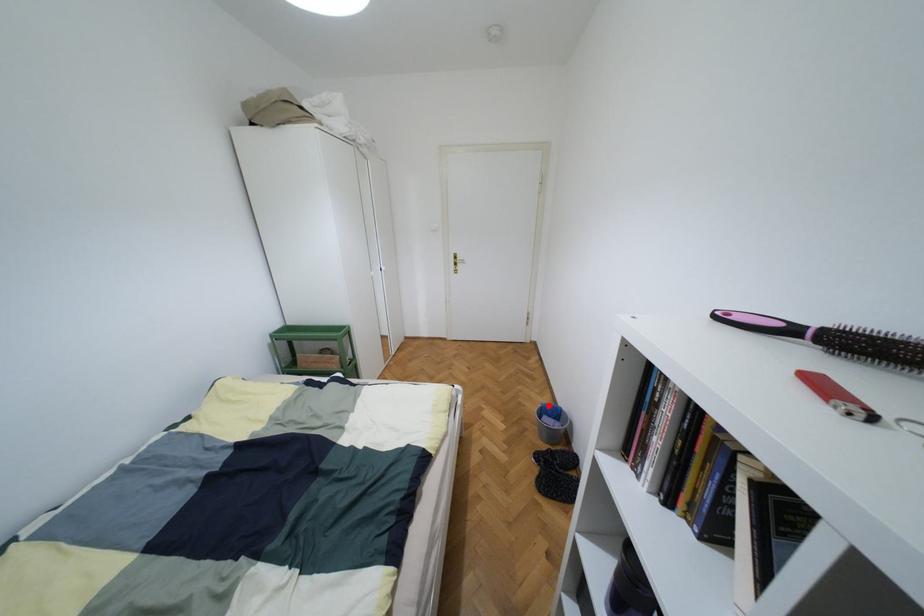
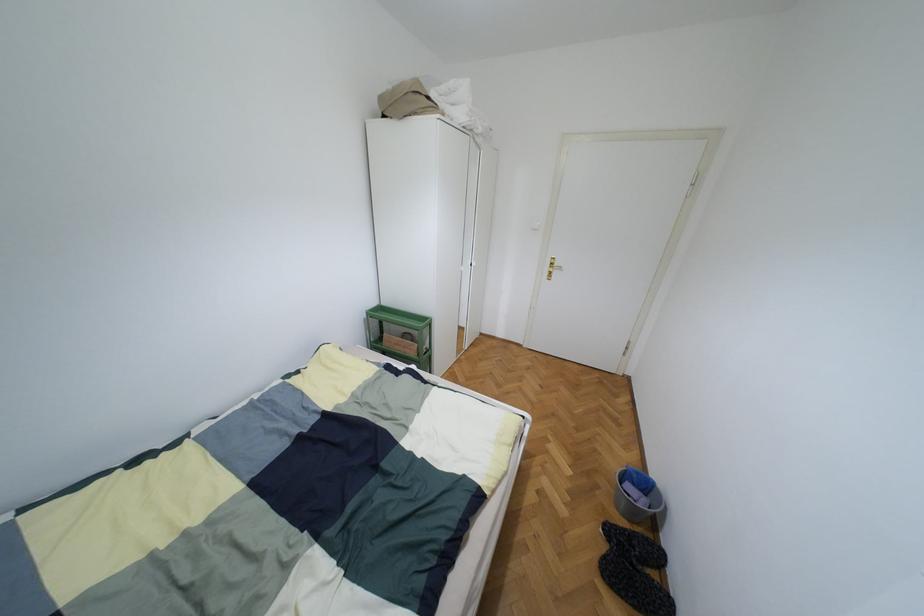
Question: I am providing you with two images of the same scene from different viewpoints. In image1, a red point is highlighted. Considering the same 3D point in image2, which of the following is correct?

Choices:
 (A) It is closer
 (B) It is farther

Answer: (B)